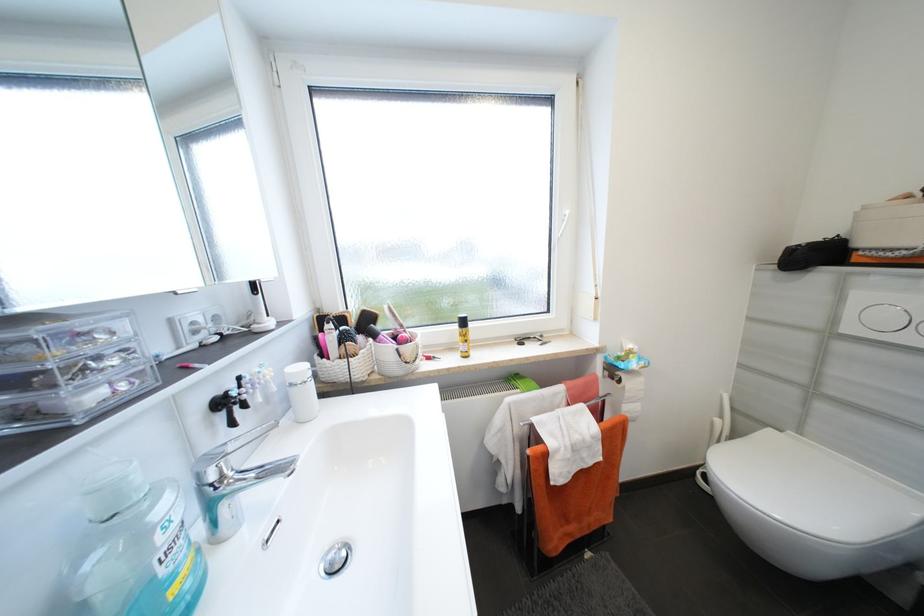
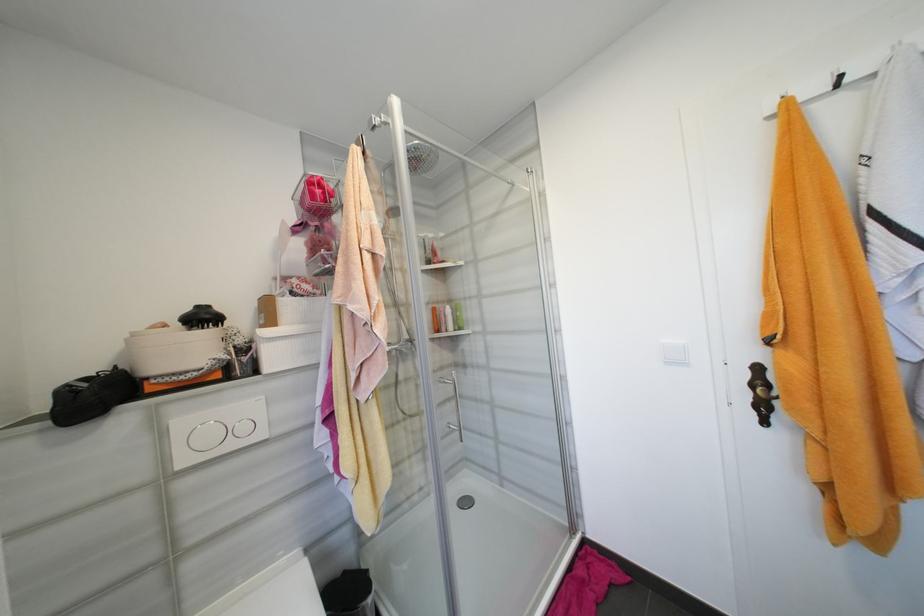
Question: I am providing you with two images of the same scene from different viewpoints. After the viewpoint changes to image2, which objects are now occluded?

Choices:
 (A) round white container
 (B) white storage box
 (C) large flush button
 (D) none of these

Answer: (D)